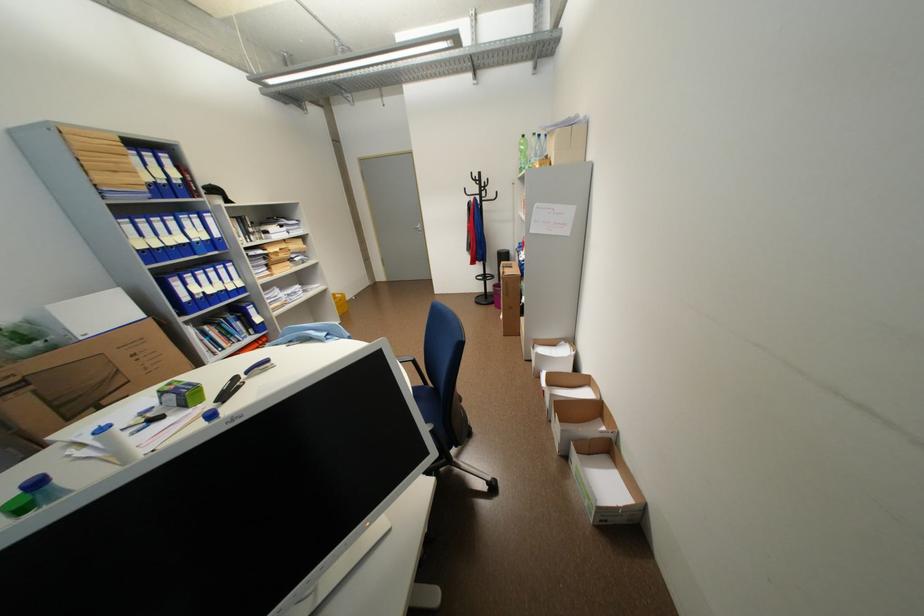
Where is `silver door handle`? This screenshot has height=616, width=924. silver door handle is located at coordinates (418, 225).